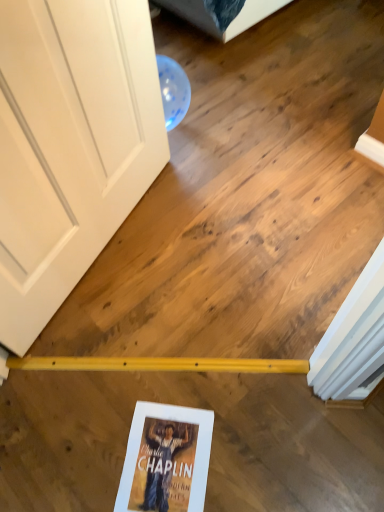
You are a GUI agent. You are given a task and a screenshot of the screen. Output one action in this format:
    pyautogui.click(x=<x>, y=<y>)
    Task: Click on the vacant area situated to the left side of hardcover book at lower center
    The image size is (384, 512).
    Given the screenshot: What is the action you would take?
    pyautogui.click(x=79, y=455)